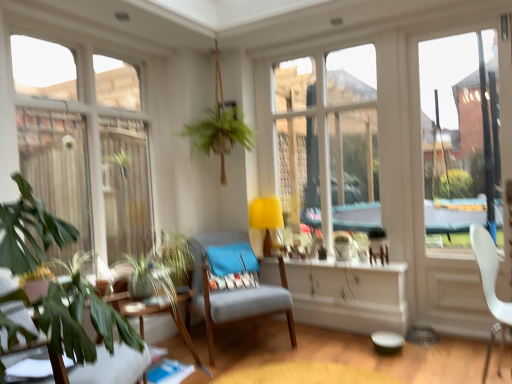
Question: Is green leafy plant at lower left at the right side of transparent glass window at left?

Choices:
 (A) no
 (B) yes

Answer: (B)

Question: Considering the relative sizes of green leafy plant at lower left and transparent glass window at left in the image provided, is green leafy plant at lower left taller than transparent glass window at left?

Choices:
 (A) yes
 (B) no

Answer: (B)

Question: Does green leafy plant at lower left appear on the left side of transparent glass window at left?

Choices:
 (A) yes
 (B) no

Answer: (B)

Question: Would you say green leafy plant at lower left is a long distance from transparent glass window at left?

Choices:
 (A) no
 (B) yes

Answer: (B)

Question: Is green leafy plant at lower left facing away from transparent glass window at left?

Choices:
 (A) yes
 (B) no

Answer: (B)

Question: Considering the positions of transparent glass door at right and wooden table at lower left in the image, is transparent glass door at right wider or thinner than wooden table at lower left?

Choices:
 (A) thin
 (B) wide

Answer: (A)

Question: From their relative heights in the image, would you say transparent glass door at right is taller or shorter than wooden table at lower left?

Choices:
 (A) tall
 (B) short

Answer: (A)

Question: Considering the positions of transparent glass door at right and wooden table at lower left in the image, is transparent glass door at right bigger or smaller than wooden table at lower left?

Choices:
 (A) big
 (B) small

Answer: (A)

Question: From a real-world perspective, is transparent glass door at right above or below wooden table at lower left?

Choices:
 (A) below
 (B) above

Answer: (B)

Question: Is yellow fabric lampshade at center bigger or smaller than green leafy plant at lower left, marked as the 3th chair in a right-to-left arrangement?

Choices:
 (A) big
 (B) small

Answer: (B)

Question: In terms of width, does yellow fabric lampshade at center look wider or thinner when compared to green leafy plant at lower left, which is counted as the 1th chair, starting from the left?

Choices:
 (A) thin
 (B) wide

Answer: (A)

Question: Visually, is yellow fabric lampshade at center positioned to the left or to the right of green leafy plant at lower left, marked as the 1th chair in a front-to-back arrangement?

Choices:
 (A) right
 (B) left

Answer: (A)

Question: Choose the correct answer: Is yellow fabric lampshade at center inside green leafy plant at lower left, marked as the 3th chair in a right-to-left arrangement, or outside it?

Choices:
 (A) inside
 (B) outside

Answer: (B)

Question: Is point (487, 261) closer or farther from the camera than point (67, 155)?

Choices:
 (A) farther
 (B) closer

Answer: (B)

Question: Is white plastic chair at right, which is the 2th chair from back to front, wider or thinner than transparent glass window at left?

Choices:
 (A) thin
 (B) wide

Answer: (A)